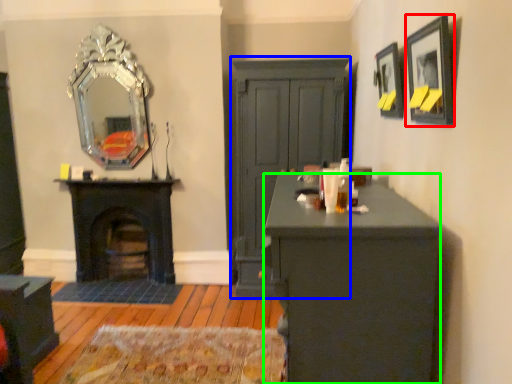
Question: Which object is positioned farthest from picture frame (highlighted by a red box)? Select from dresser (highlighted by a blue box) and desk (highlighted by a green box).

Choices:
 (A) dresser
 (B) desk

Answer: (A)